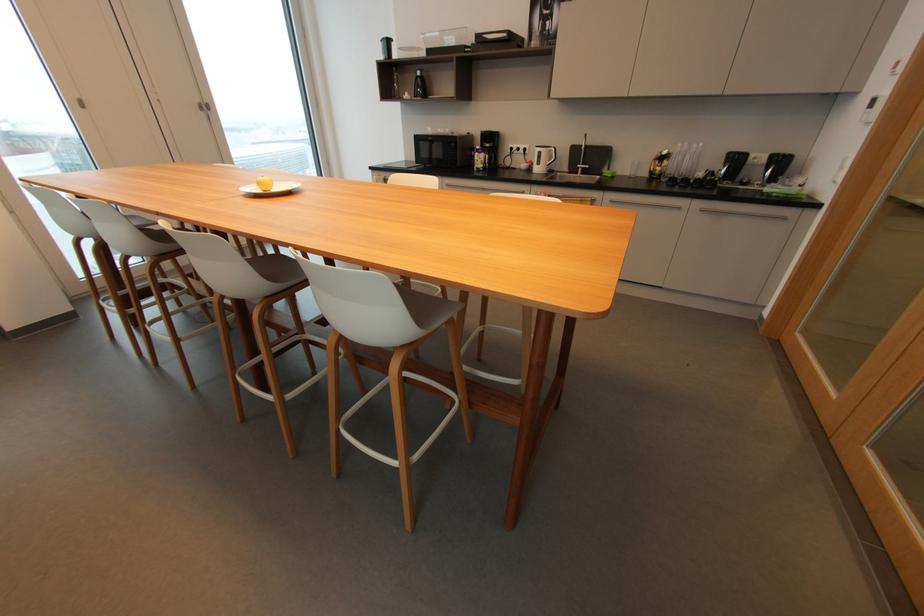
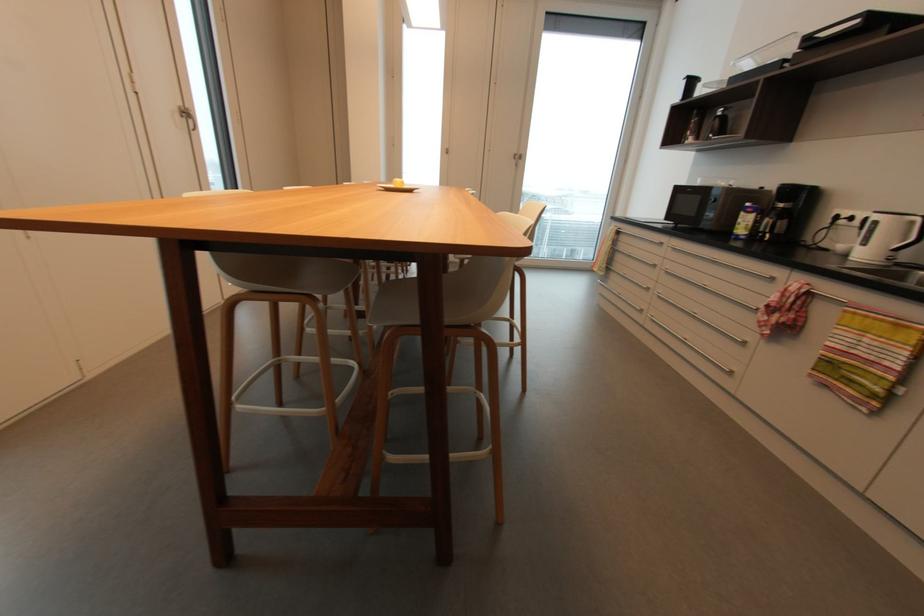
Where in the second image is the point corresponding to (x=554, y=151) from the first image?

(916, 223)